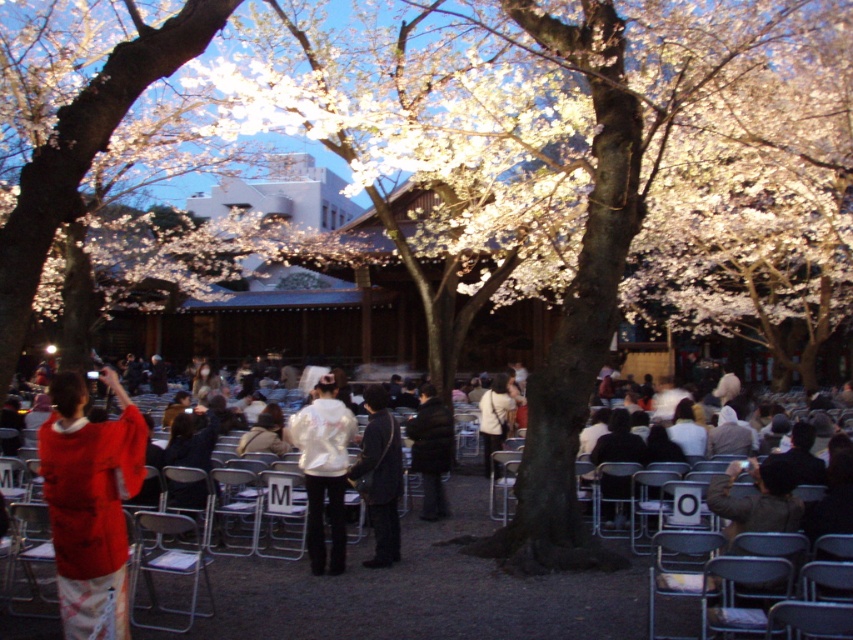
You are attending a cherry blossom event and want to sit down. You see the metallic gray chair at lower right and the black matte jacket at center. Which object is closer to the ground?

The metallic gray chair at lower right is closer to the ground because it is below the black matte jacket at center.